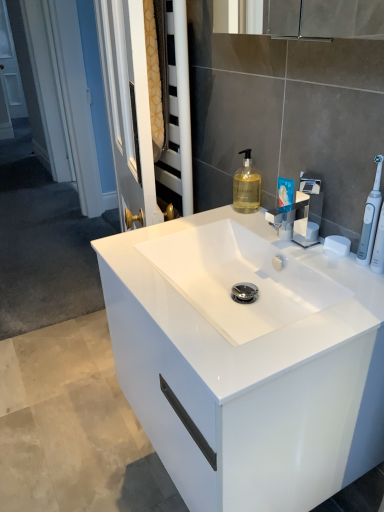
Question: Should I look upward or downward to see white matte soap at upper right?

Choices:
 (A) down
 (B) up

Answer: (B)

Question: Is blue glossy toothpaste tube at upper right next to satin nickel faucet at center?

Choices:
 (A) no
 (B) yes

Answer: (B)

Question: Is the position of blue glossy toothpaste tube at upper right more distant than that of satin nickel faucet at center?

Choices:
 (A) yes
 (B) no

Answer: (A)

Question: Is blue glossy toothpaste tube at upper right to the right of satin nickel faucet at center from the viewer's perspective?

Choices:
 (A) no
 (B) yes

Answer: (A)

Question: From a real-world perspective, is blue glossy toothpaste tube at upper right positioned under satin nickel faucet at center based on gravity?

Choices:
 (A) no
 (B) yes

Answer: (B)

Question: Does blue glossy toothpaste tube at upper right have a larger size compared to satin nickel faucet at center?

Choices:
 (A) yes
 (B) no

Answer: (B)

Question: From a real-world perspective, is blue glossy toothpaste tube at upper right physically above satin nickel faucet at center?

Choices:
 (A) no
 (B) yes

Answer: (A)

Question: Is satin nickel faucet at center taller than white matte soap at upper right?

Choices:
 (A) yes
 (B) no

Answer: (A)

Question: Would you consider satin nickel faucet at center to be distant from white matte soap at upper right?

Choices:
 (A) no
 (B) yes

Answer: (A)

Question: Is satin nickel faucet at center thinner than white matte soap at upper right?

Choices:
 (A) yes
 (B) no

Answer: (B)

Question: Considering the relative positions of satin nickel faucet at center and white matte soap at upper right in the image provided, is satin nickel faucet at center to the right of white matte soap at upper right from the viewer's perspective?

Choices:
 (A) no
 (B) yes

Answer: (A)

Question: Can white matte soap at upper right be found inside satin nickel faucet at center?

Choices:
 (A) no
 (B) yes

Answer: (A)

Question: Could you tell me if satin nickel faucet at center is facing white matte soap at upper right?

Choices:
 (A) no
 (B) yes

Answer: (A)

Question: Is blue glossy toothpaste tube at upper right smaller than white matte soap at upper right?

Choices:
 (A) no
 (B) yes

Answer: (A)